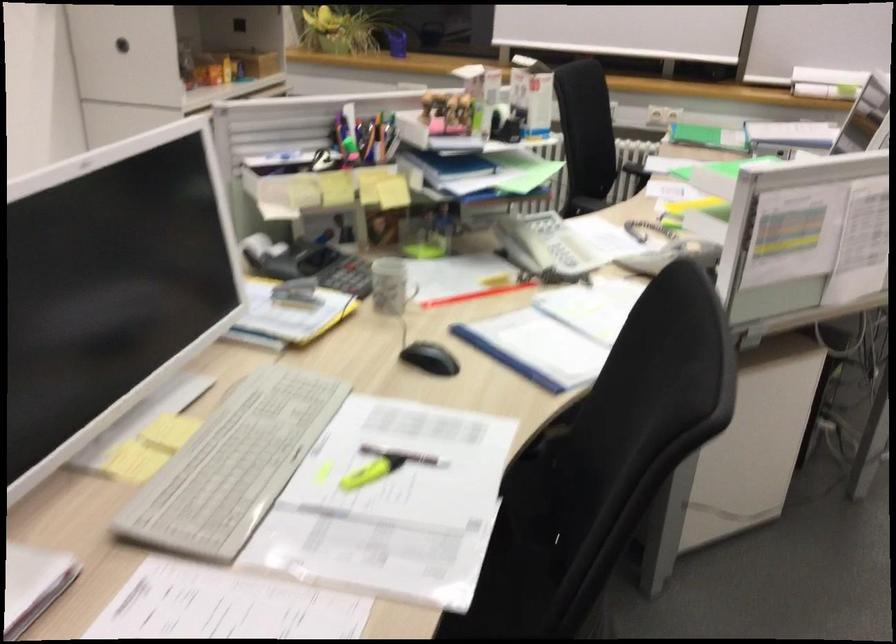
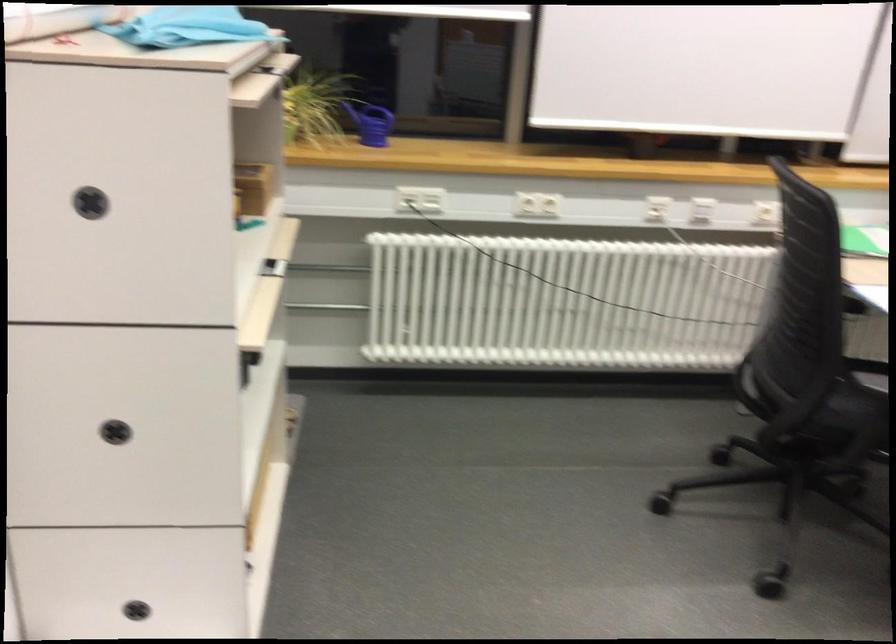
The images are taken continuously from a first-person perspective. In which direction are you moving?

The cameraman walked toward left, forward.